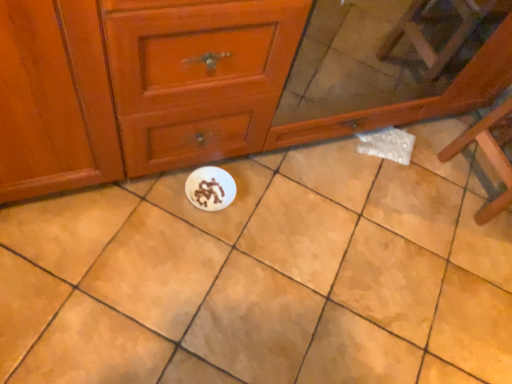
Where is `vacant space in front of white matte paper plate at center`? The width and height of the screenshot is (512, 384). vacant space in front of white matte paper plate at center is located at coordinates (191, 245).